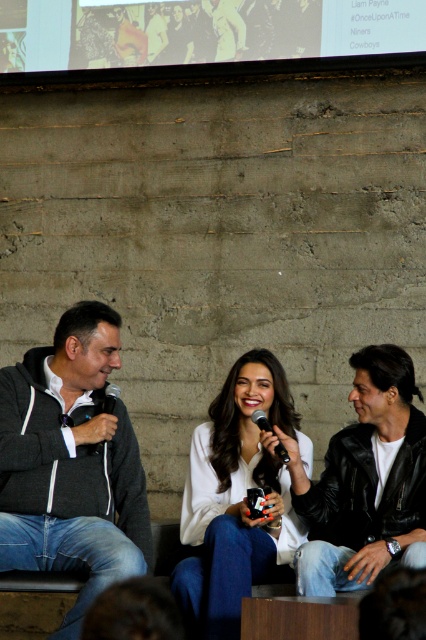
Between black matte microphone at center and metallic silver microphone at center, which one appears on the left side from the viewer's perspective?

Positioned to the left is black matte microphone at center.

Based on the photo, measure the distance between black matte microphone at center and metallic silver microphone at center.

A distance of 15.79 inches exists between black matte microphone at center and metallic silver microphone at center.

Who is more distant from viewer, (97, 448) or (279, 445)?

The point (97, 448) is behind.

Find the location of a particular element. Image resolution: width=426 pixels, height=640 pixels. black matte microphone at center is located at coordinates (108, 397).

Between dark gray hoodie at left and metallic silver microphone at center, which one has more height?

dark gray hoodie at left

Does point (31, 372) come closer to viewer compared to point (267, 422)?

No, (31, 372) is further to viewer.

The width and height of the screenshot is (426, 640). In order to click on dark gray hoodie at left in this screenshot , I will do pos(71,464).

Who is more forward, (x=29, y=536) or (x=115, y=401)?

Point (x=29, y=536)

Who is shorter, dark gray hoodie at left or black matte microphone at center?

black matte microphone at center is shorter.

Which is behind, point (28, 554) or point (106, 406)?

The point (106, 406) is more distant.

This screenshot has height=640, width=426. I want to click on dark gray hoodie at left, so click(71, 464).